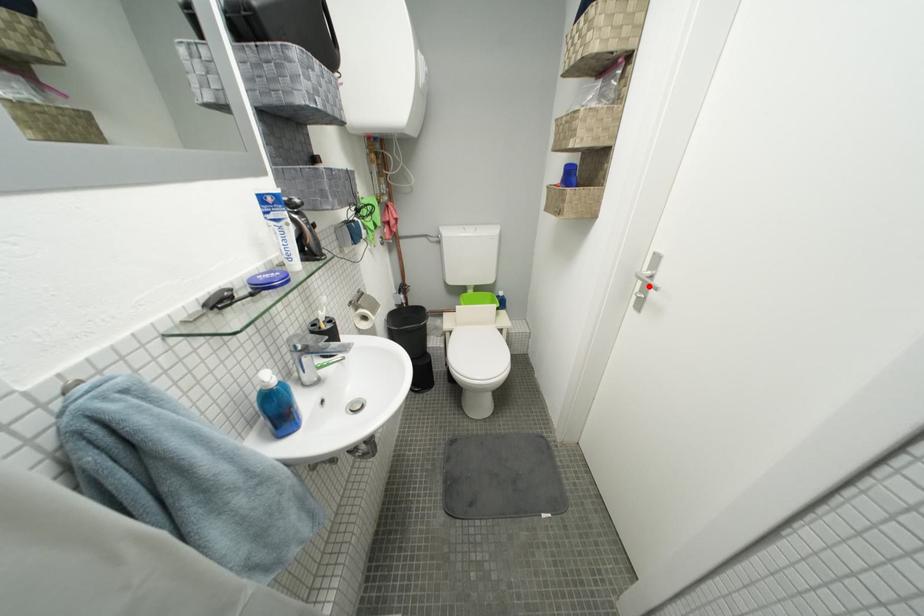
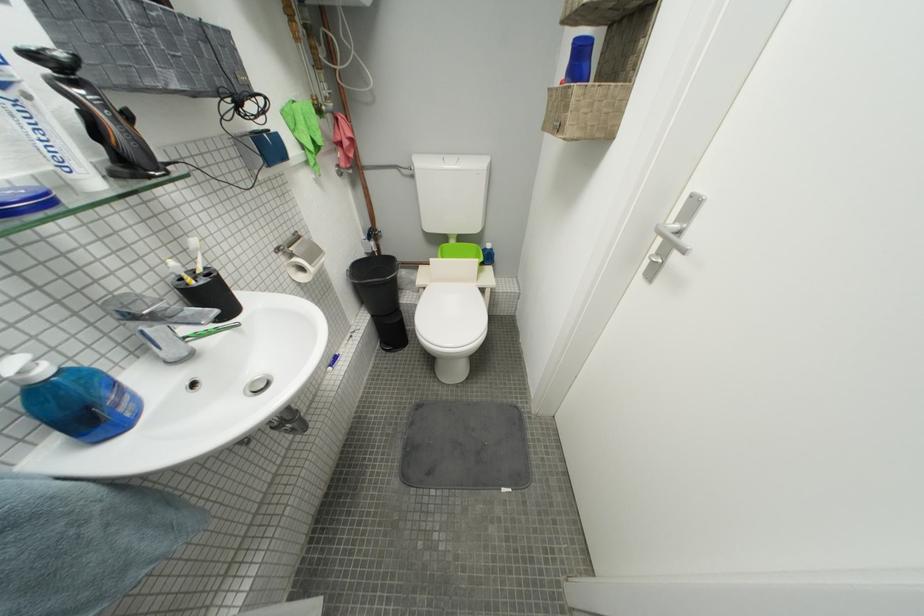
The point at the highlighted location is marked in the first image. Where is the corresponding point in the second image?

(669, 244)